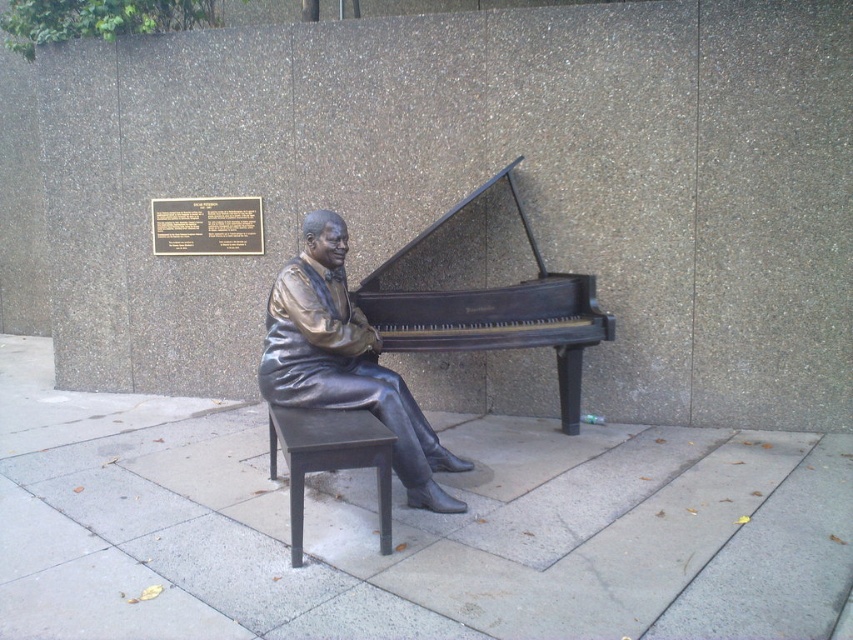
Between point (383, 419) and point (456, 348), which one is positioned behind?

Point (456, 348)

Consider the image. Does bronze statue at center appear under bronze polished piano at center?

Yes.

Between point (276, 362) and point (431, 330), which one is positioned in front?

Positioned in front is point (276, 362).

Identify the location of bronze statue at center. Image resolution: width=853 pixels, height=640 pixels. (345, 362).

Can you confirm if bronze polished piano at center is positioned to the right of matte black stool at center?

Correct, you'll find bronze polished piano at center to the right of matte black stool at center.

In the scene shown: Does bronze polished piano at center appear on the left side of matte black stool at center?

Incorrect, bronze polished piano at center is not on the left side of matte black stool at center.

Is point (538, 292) positioned behind point (357, 467)?

Yes.

Identify the location of bronze polished piano at center. (494, 310).

Between point (74, 573) and point (318, 230), which one is positioned behind?

Positioned behind is point (318, 230).

Is point (654, 580) farther from camera compared to point (282, 400)?

No, it is in front of (282, 400).

Identify the location of gray concrete pavement at center. The height and width of the screenshot is (640, 853). (405, 528).

Where is `gray concrete pavement at center`? This screenshot has height=640, width=853. gray concrete pavement at center is located at coordinates (405, 528).